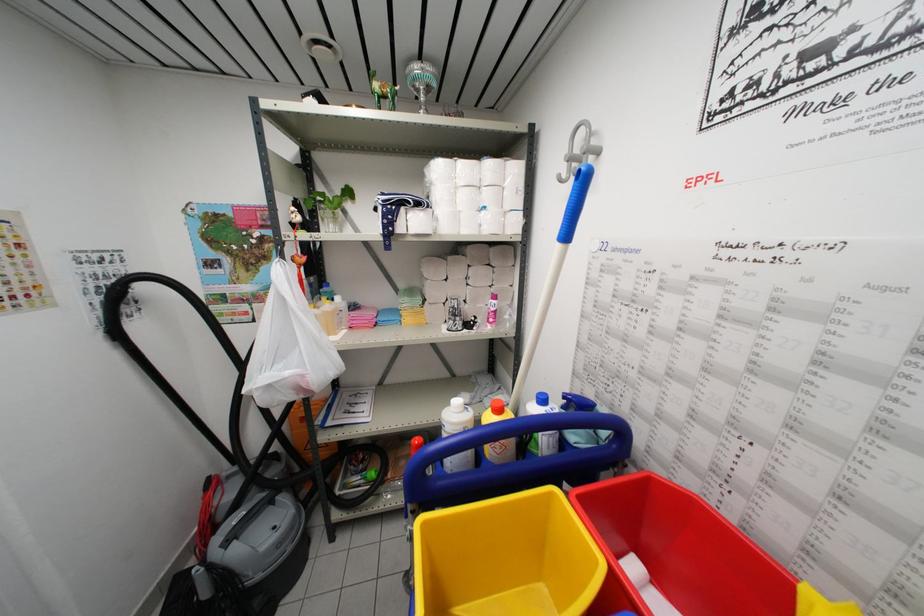
What do you see at coordinates (288, 346) in the screenshot? The width and height of the screenshot is (924, 616). I see `the white plastic bag` at bounding box center [288, 346].